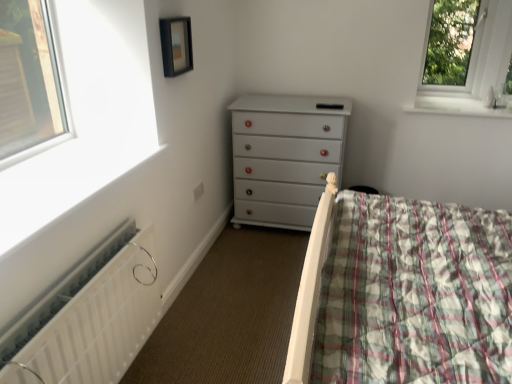
Question: In the image, is transparent glass window at upper right positioned in front of or behind matte black picture frame at upper center?

Choices:
 (A) front
 (B) behind

Answer: (B)

Question: From a real-world perspective, is transparent glass window at upper right above or below matte black picture frame at upper center?

Choices:
 (A) below
 (B) above

Answer: (A)

Question: Which is farther from the transparent glass window at upper right?

Choices:
 (A) white glossy window sill at upper right
 (B) white matte radiator at lower left
 (C) white painted wood chest of drawers at center
 (D) matte black picture frame at upper center

Answer: (B)

Question: Based on their relative distances, which object is farther from the white matte radiator at lower left?

Choices:
 (A) matte black picture frame at upper center
 (B) white glossy window sill at upper right
 (C) transparent glass window at upper right
 (D) white painted wood chest of drawers at center

Answer: (C)